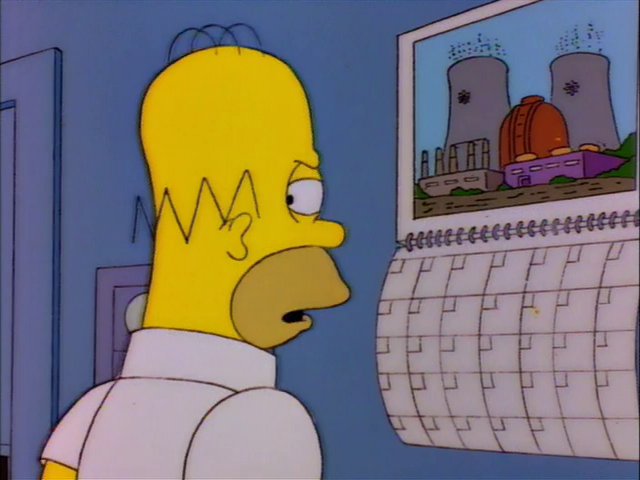
Find the location of a particular element. The height and width of the screenshot is (480, 640). calander is located at coordinates (461, 324).